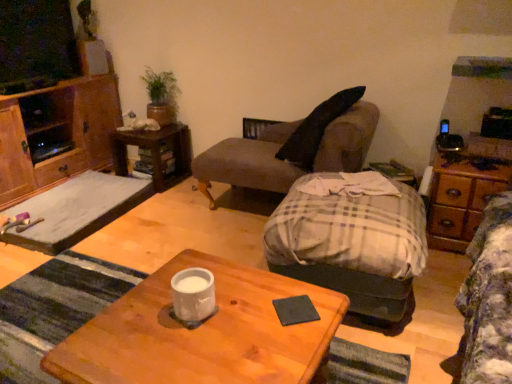
You are a GUI agent. You are given a task and a screenshot of the screen. Output one action in this format:
    pyautogui.click(x=<x>, y=<y>)
    Task: Click on the free location in front of black matte coaster at center
    Image resolution: width=512 pixels, height=384 pixels.
    Given the screenshot: What is the action you would take?
    pyautogui.click(x=287, y=347)